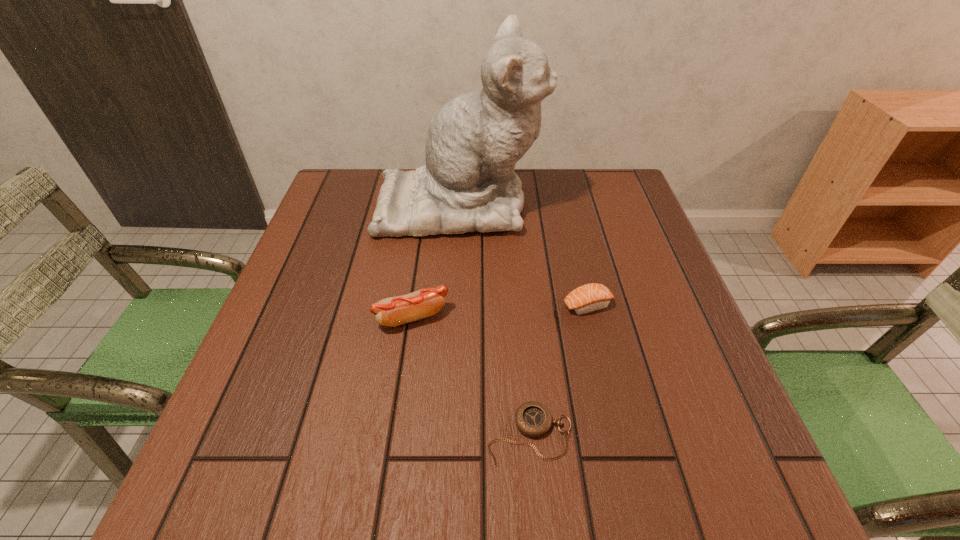
Where is `blank area located 0.300m on the left of the shortest object`? blank area located 0.300m on the left of the shortest object is located at coordinates (309, 434).

The image size is (960, 540). In order to click on object that is at the far edge in this screenshot , I will do `click(474, 141)`.

Locate an element on the screen. This screenshot has width=960, height=540. object that is positioned at the near edge is located at coordinates (533, 419).

Locate an element on the screen. This screenshot has height=540, width=960. object located in the left edge section of the desktop is located at coordinates (474, 141).

What are the coordinates of `object that is at the right edge` in the screenshot? It's located at (592, 297).

In order to click on object present at the far left corner in this screenshot , I will do `click(474, 141)`.

The width and height of the screenshot is (960, 540). Find the location of `vacant space at the far edge`. vacant space at the far edge is located at coordinates (565, 177).

The height and width of the screenshot is (540, 960). I want to click on free location at the near edge, so click(x=395, y=483).

This screenshot has height=540, width=960. Identify the location of vacant position at the left edge of the desktop. (328, 233).

Identify the location of vacant space at the right edge of the desktop. (693, 357).